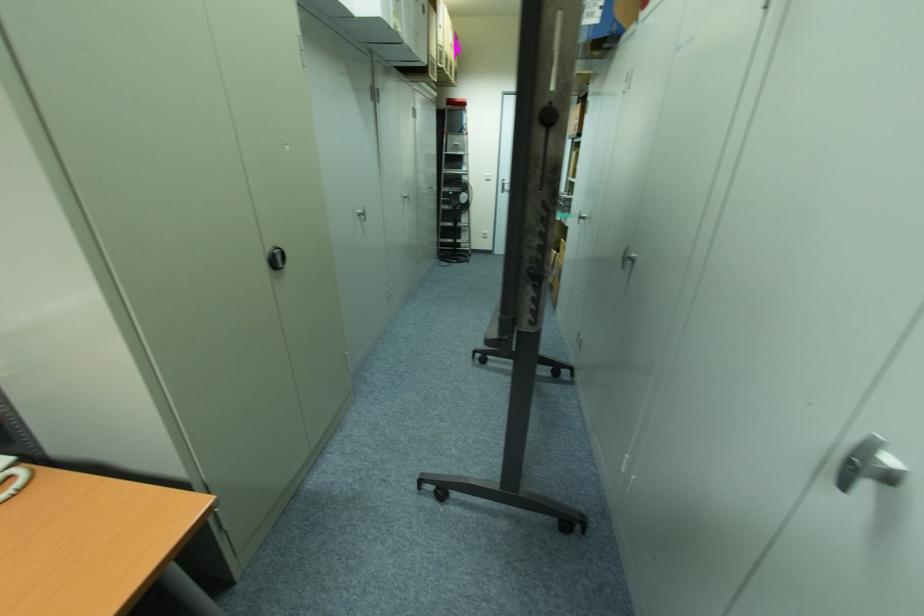
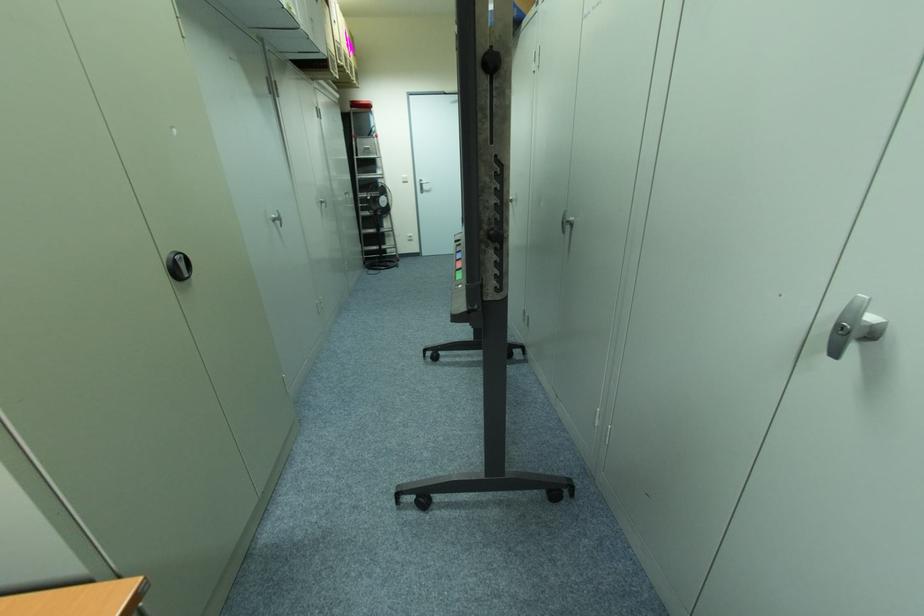
The point at (x=636, y=254) is marked in the first image. Where is the corresponding point in the second image?

(572, 219)